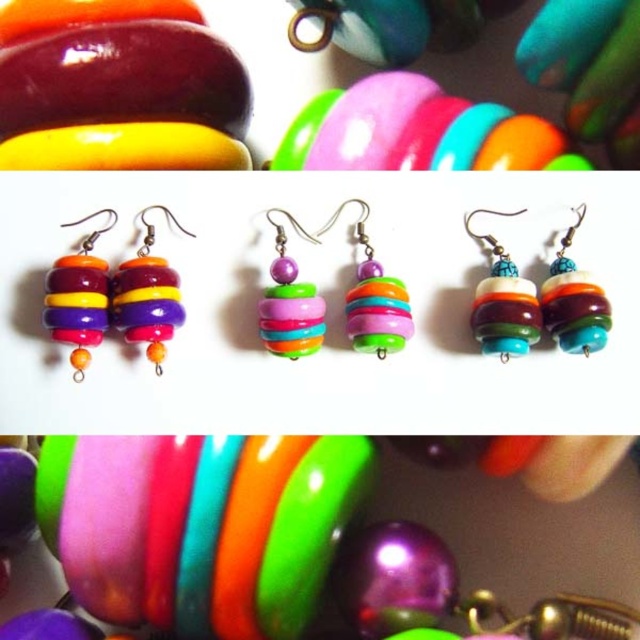
Between glossy plastic bracelet at center and shiny plastic bracelet at upper center, which one appears on the right side from the viewer's perspective?

shiny plastic bracelet at upper center is more to the right.

Between glossy plastic bracelet at center and shiny plastic bracelet at upper center, which one has more height?

Standing taller between the two is glossy plastic bracelet at center.

Is point (116, 564) closer to camera compared to point (509, 168)?

Yes, point (116, 564) is closer to viewer.

The width and height of the screenshot is (640, 640). I want to click on glossy plastic bracelet at center, so click(x=198, y=525).

Can you confirm if matte glass beads at center is shorter than matte multicolored beads at center?

In fact, matte glass beads at center may be taller than matte multicolored beads at center.

Is matte glass beads at center taller than matte multicolored beads at center?

Indeed, matte glass beads at center has a greater height compared to matte multicolored beads at center.

Who is more distant from viewer, [486,340] or [580,301]?

Positioned behind is point [486,340].

The height and width of the screenshot is (640, 640). Find the location of `matte glass beads at center`. matte glass beads at center is located at coordinates (502, 301).

In the scene shown: Measure the distance from shiny plastic bracelet at upper center to matte glass beads at center.

shiny plastic bracelet at upper center and matte glass beads at center are 7.44 inches apart.

Is shiny plastic bracelet at upper center taller than matte glass beads at center?

No, shiny plastic bracelet at upper center is not taller than matte glass beads at center.

Does point (308, 163) come farther from viewer compared to point (488, 243)?

Yes, it is.

You are a GUI agent. You are given a task and a screenshot of the screen. Output one action in this format:
    pyautogui.click(x=<x>, y=<y>)
    Task: Click on the shiny plastic bracelet at upper center
    The width and height of the screenshot is (640, 640).
    Given the screenshot: What is the action you would take?
    pyautogui.click(x=417, y=131)